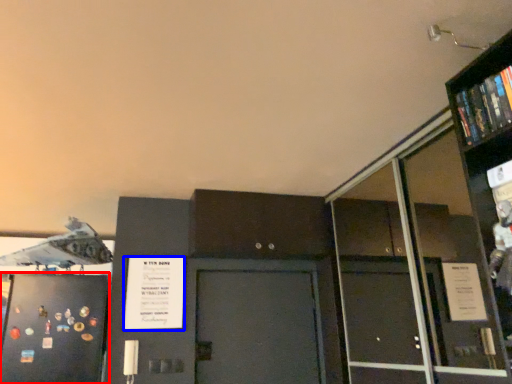
Question: Which of the following is the closest to the observer, door (highlighted by a red box) or poster (highlighted by a blue box)?

Choices:
 (A) door
 (B) poster

Answer: (A)